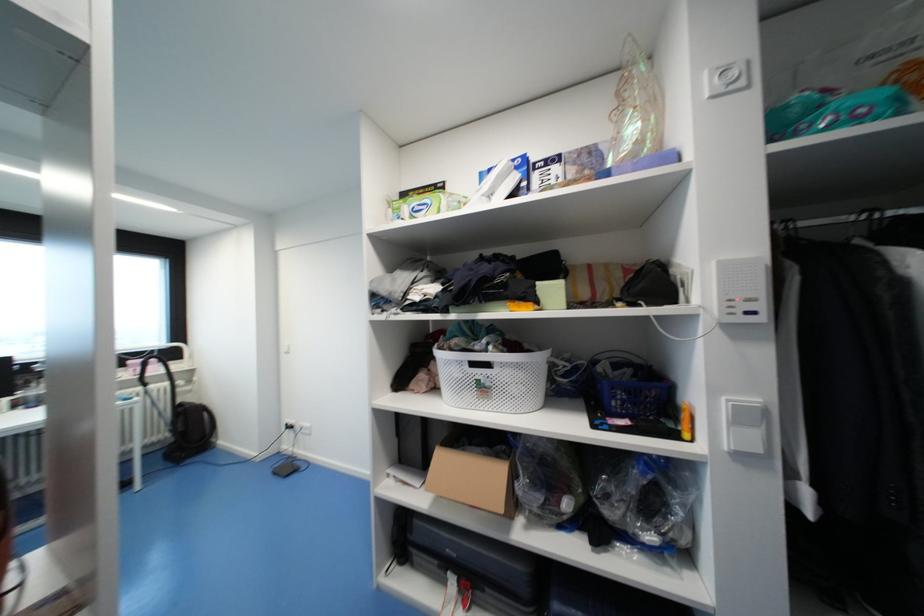
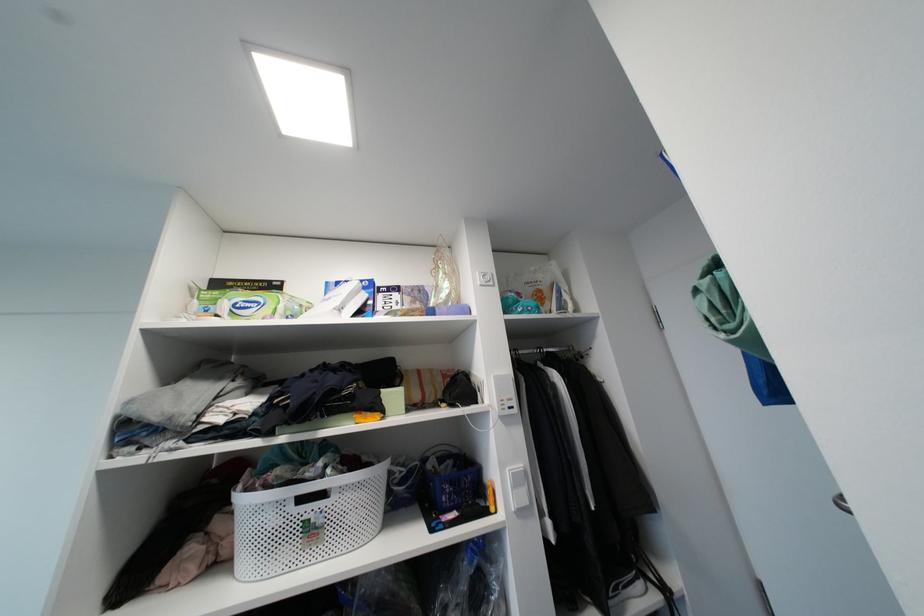
Where in the second image is the point corresponding to point (895, 214) from the first image?

(550, 351)